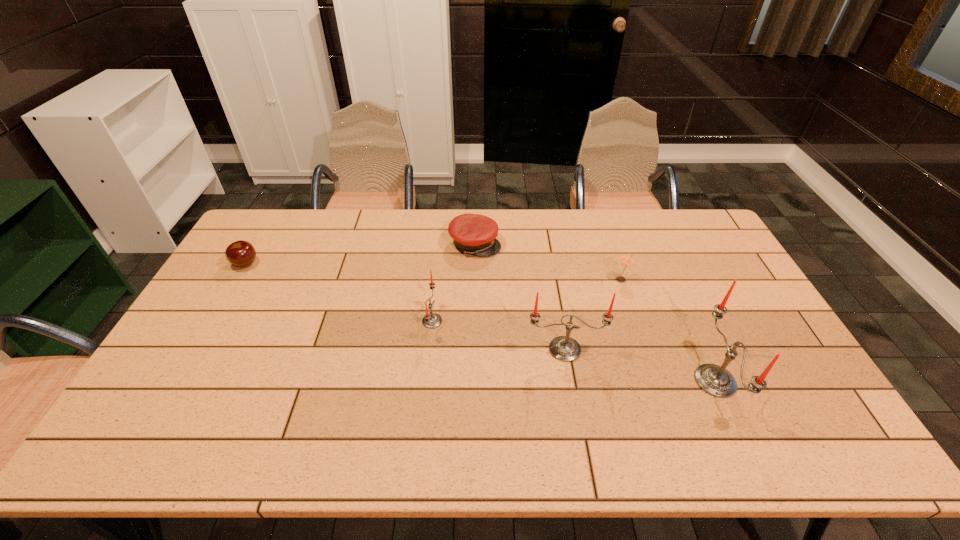
Where is `vacant area that lies between the fourth object from left to right and the straw`? vacant area that lies between the fourth object from left to right and the straw is located at coordinates (593, 315).

Locate an element on the screen. The height and width of the screenshot is (540, 960). vacant area that lies between the second object from left to right and the second candle from left to right is located at coordinates coord(498,335).

Identify which object is the closest to the fourth object from left to right. Please provide its 2D coordinates. Your answer should be formatted as a tuple, i.e. [(x, y)], where the tuple contains the x and y coordinates of a point satisfying the conditions above.

[(715, 380)]

What are the coordinates of `object identified as the second closest to the rightmost candle` in the screenshot? It's located at (626, 259).

This screenshot has width=960, height=540. I want to click on candle that is the closest to the second candle from right to left, so click(x=715, y=380).

Locate an element on the screen. the closest candle to the fourth object from right to left is located at coordinates (432, 320).

Where is `vacant space that satisfies the following two spatial constraints: 1. on the front side of the fourth nearest object; 2. on the front-facing side of the shortest candle`? The image size is (960, 540). vacant space that satisfies the following two spatial constraints: 1. on the front side of the fourth nearest object; 2. on the front-facing side of the shortest candle is located at coordinates (635, 321).

Identify the location of vacant area in the image that satisfies the following two spatial constraints: 1. on the front of the fourth nearest object with an emblem; 2. on the left side of the fourth object from right to left. This screenshot has height=540, width=960. (474, 280).

I want to click on free region that satisfies the following two spatial constraints: 1. on the front of the straw with an emblem; 2. on the right side of the fourth object from right to left, so click(x=474, y=280).